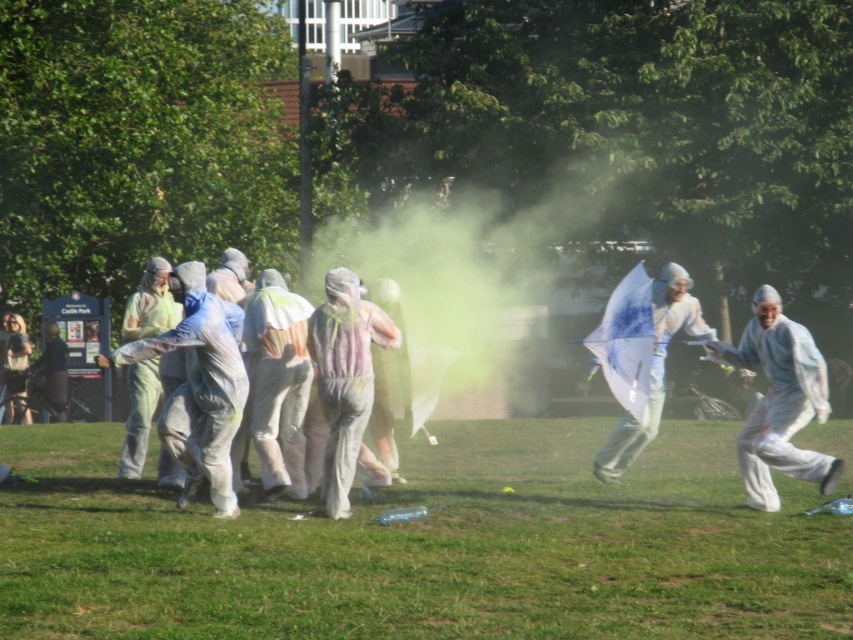
Question: Which point appears farthest from the camera in this image?

Choices:
 (A) (131, 432)
 (B) (738, 458)
 (C) (181, 428)

Answer: (A)

Question: Is white matte jumpsuit at right wider than white matte jumpsuit at center?

Choices:
 (A) no
 (B) yes

Answer: (B)

Question: Which of the following is the closest to the observer?

Choices:
 (A) (657, 289)
 (B) (251, 317)
 (C) (761, 304)

Answer: (C)

Question: Among these objects, which one is nearest to the camera?

Choices:
 (A) white matte umbrella at right
 (B) light green fabric at center

Answer: (B)

Question: Can you confirm if white matte jumpsuit at right is positioned to the left of white matte umbrella at right?

Choices:
 (A) yes
 (B) no

Answer: (B)

Question: Does green grass at lower center lie behind rainbow-colored fabric at center?

Choices:
 (A) no
 (B) yes

Answer: (A)